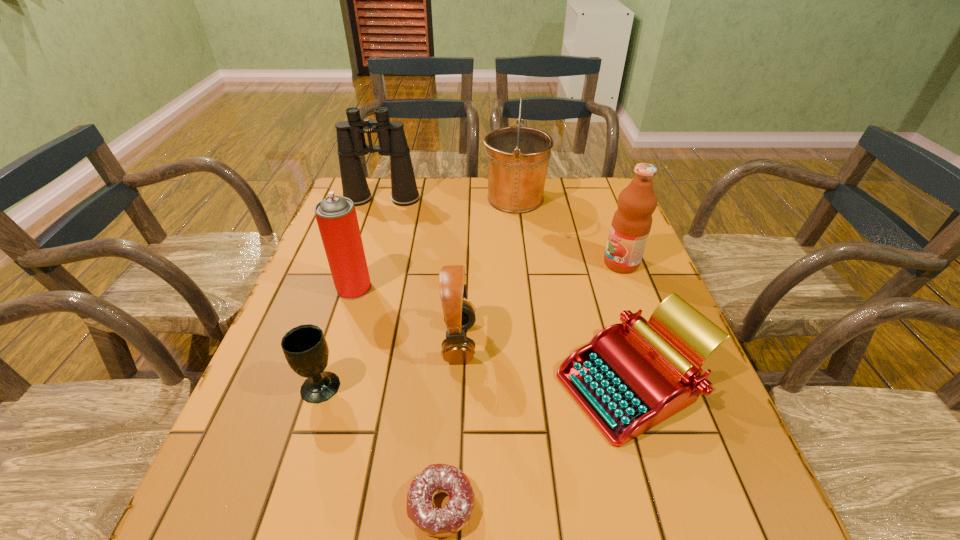
The height and width of the screenshot is (540, 960). What are the coordinates of `bucket` in the screenshot? It's located at (518, 156).

Where is `binoculars`? binoculars is located at coordinates (351, 142).

The image size is (960, 540). I want to click on the third farthest object, so click(631, 224).

Where is `the fifth nearest object`? the fifth nearest object is located at coordinates (336, 216).

What are the coordinates of `headset` in the screenshot? It's located at (459, 315).

At what (x,y) coordinates should I click in order to perform the action: click on chalice. Please return your answer as a coordinate pair (x, y). The width and height of the screenshot is (960, 540). Looking at the image, I should click on tap(305, 348).

You are a GUI agent. You are given a task and a screenshot of the screen. Output one action in this format:
    pyautogui.click(x=<x>, y=<y>)
    Task: Click on the typewriter
    
    Given the screenshot: What is the action you would take?
    pyautogui.click(x=631, y=376)

Locate an element on the screen. The image size is (960, 540). vacant position located 0.070m on the front of the bucket is located at coordinates (518, 232).

Locate an element on the screen. vacant space situated on the front of the binoculars is located at coordinates (358, 274).

The width and height of the screenshot is (960, 540). What are the coordinates of `vacant space located on the front label of the sixth nearest object` in the screenshot? It's located at [585, 264].